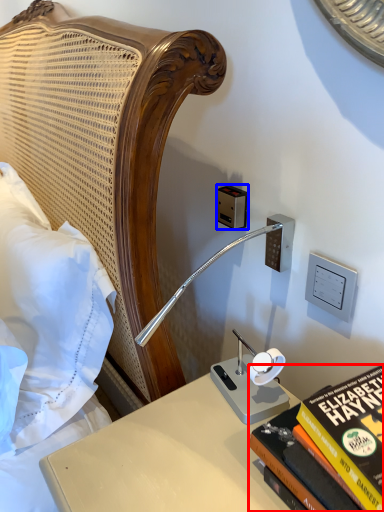
Question: Which object appears closest to the camera in this image, book (highlighted by a red box) or electric outlet (highlighted by a blue box)?

Choices:
 (A) book
 (B) electric outlet

Answer: (A)